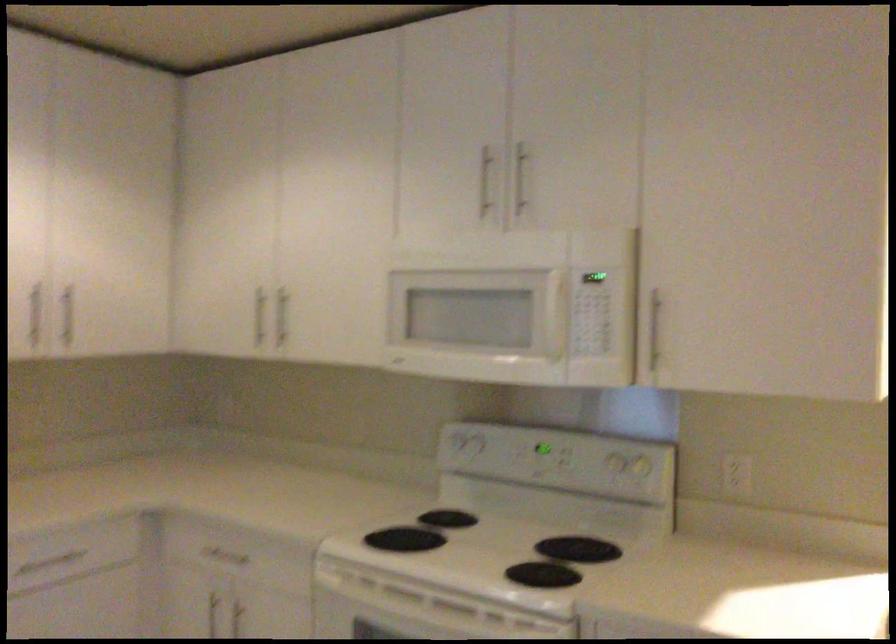
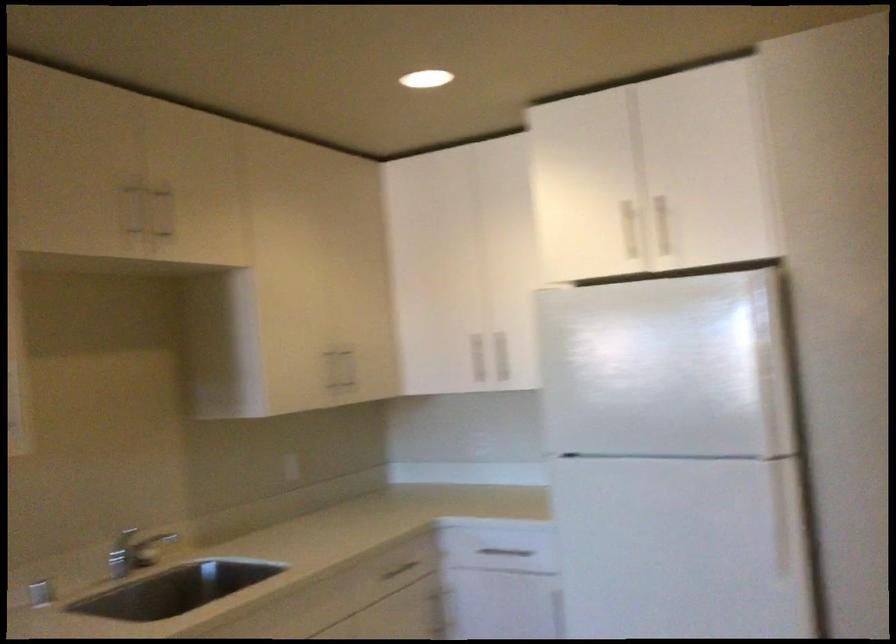
Question: Based on the continuous images, in which direction is the camera rotating? Reply with the corresponding letter.

Choices:
 (A) Left
 (B) Right
 (C) Up
 (D) Down

Answer: (A)